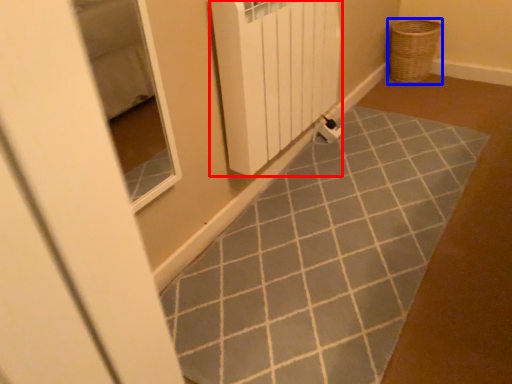
Question: Which of the following is the closest to the observer, radiator (highlighted by a red box) or basket (highlighted by a blue box)?

Choices:
 (A) radiator
 (B) basket

Answer: (A)